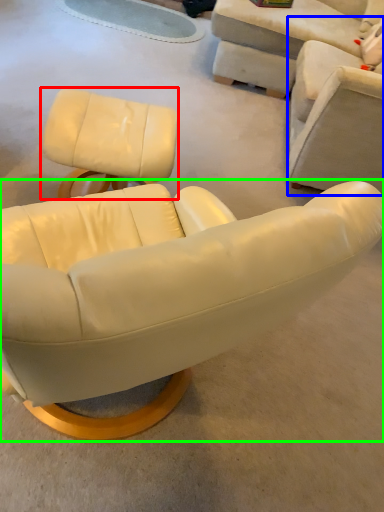
Question: Considering the real-world distances, which object is farthest from chair (highlighted by a red box)? chair (highlighted by a blue box) or chair (highlighted by a green box)?

Choices:
 (A) chair
 (B) chair

Answer: (B)